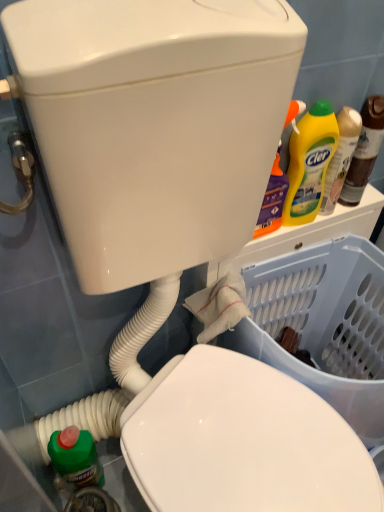
You are a GUI agent. You are given a task and a screenshot of the screen. Output one action in this format:
    pyautogui.click(x=<x>, y=<y>)
    Task: Click on the transparent plastic basket at lower right
    The height and width of the screenshot is (512, 384).
    Given the screenshot: What is the action you would take?
    pyautogui.click(x=323, y=325)

Image resolution: width=384 pixels, height=512 pixels. What are the coordinates of `cleaning product that appears on the left of transparent plastic basket at lower right` in the screenshot? It's located at (309, 163).

Based on the photo, could you tell me if yellow matte bottle at upper right is turned towards transparent plastic basket at lower right?

No, yellow matte bottle at upper right is not aimed at transparent plastic basket at lower right.

Looking at this image, can you see yellow matte bottle at upper right touching transparent plastic basket at lower right?

No.

Choose the correct answer: Is yellow matte bottle at upper right inside transparent plastic basket at lower right or outside it?

yellow matte bottle at upper right is not enclosed by transparent plastic basket at lower right.

Is yellow plastic bottle at upper right, the 1th bottle when ordered from left to right, looking in the opposite direction of transparent plastic basket at lower right?

No, yellow plastic bottle at upper right, the 1th bottle when ordered from left to right, is not facing the opposite direction of transparent plastic basket at lower right.

Considering the relative sizes of yellow plastic bottle at upper right, the 1th bottle when ordered from left to right, and transparent plastic basket at lower right in the image provided, is yellow plastic bottle at upper right, the 1th bottle when ordered from left to right, smaller than transparent plastic basket at lower right?

Yes.

What's the angular difference between yellow plastic bottle at upper right, the 1th bottle when ordered from left to right, and transparent plastic basket at lower right's facing directions?

The angular difference between yellow plastic bottle at upper right, the 1th bottle when ordered from left to right, and transparent plastic basket at lower right is 1.53 degrees.

Based on the photo, which object is closer to the camera taking this photo, yellow plastic bottle at upper right, the 2th bottle from the right, or transparent plastic basket at lower right?

transparent plastic basket at lower right is in front.

Can we say transparent plastic basket at lower right lies outside yellow plastic bottle at upper right, the 1th bottle when ordered from left to right?

Yes, transparent plastic basket at lower right is located beyond the bounds of yellow plastic bottle at upper right, the 1th bottle when ordered from left to right.

Is point (266, 293) more distant than point (353, 133)?

Yes.

Does transparent plastic basket at lower right touch yellow plastic bottle at upper right, the 1th bottle when ordered from left to right?

transparent plastic basket at lower right and yellow plastic bottle at upper right, the 1th bottle when ordered from left to right, are clearly separated.

Does transparent plastic basket at lower right lie in front of yellow matte bottle at upper right?

Result: Yes, the depth of transparent plastic basket at lower right is less than that of yellow matte bottle at upper right.

Which point is more distant from viewer, (282, 359) or (301, 190)?

The point (301, 190) is farther.

Which of these two, transparent plastic basket at lower right or yellow matte bottle at upper right, is bigger?

transparent plastic basket at lower right.

From a real-world perspective, between yellow liquid detergent at upper right, which is the second bottle from left to right, and yellow matte bottle at upper right, who is vertically lower?

In real-world perspective, yellow liquid detergent at upper right, which is the second bottle from left to right, is lower.

Does yellow liquid detergent at upper right, which is the 1th bottle from right to left, appear on the left side of yellow matte bottle at upper right?

Incorrect, yellow liquid detergent at upper right, which is the 1th bottle from right to left, is not on the left side of yellow matte bottle at upper right.

Is yellow liquid detergent at upper right, which is the second bottle from left to right, facing away from yellow matte bottle at upper right?

No.

Which of these two, yellow liquid detergent at upper right, which is the 1th bottle from right to left, or yellow matte bottle at upper right, stands shorter?

yellow liquid detergent at upper right, which is the 1th bottle from right to left.

From a real-world perspective, is yellow liquid detergent at upper right, which is the 1th bottle from right to left, above or below yellow plastic bottle at upper right, the 1th bottle when ordered from left to right?

From a real-world perspective, yellow liquid detergent at upper right, which is the 1th bottle from right to left, is physically above yellow plastic bottle at upper right, the 1th bottle when ordered from left to right.

Is yellow liquid detergent at upper right, which is the second bottle from left to right, facing towards yellow plastic bottle at upper right, the 2th bottle from the right?

No, yellow liquid detergent at upper right, which is the second bottle from left to right, is not oriented towards yellow plastic bottle at upper right, the 2th bottle from the right.

Is yellow liquid detergent at upper right, which is the second bottle from left to right, completely or partially outside of yellow plastic bottle at upper right, the 2th bottle from the right?

Yes, yellow liquid detergent at upper right, which is the second bottle from left to right, is outside of yellow plastic bottle at upper right, the 2th bottle from the right.

Visually, is transparent plastic basket at lower right positioned to the left or to the right of yellow liquid detergent at upper right, which is the 1th bottle from right to left?

transparent plastic basket at lower right is to the left of yellow liquid detergent at upper right, which is the 1th bottle from right to left.

Can you confirm if transparent plastic basket at lower right is wider than yellow liquid detergent at upper right, which is the 1th bottle from right to left?

Correct, the width of transparent plastic basket at lower right exceeds that of yellow liquid detergent at upper right, which is the 1th bottle from right to left.

Which object is more forward, transparent plastic basket at lower right or yellow liquid detergent at upper right, which is the second bottle from left to right?

transparent plastic basket at lower right.

Is transparent plastic basket at lower right turned away from yellow liquid detergent at upper right, which is the 1th bottle from right to left?

No, transparent plastic basket at lower right is not facing away from yellow liquid detergent at upper right, which is the 1th bottle from right to left.

Where is `cleaning product behind the transparent plastic basket at lower right`? cleaning product behind the transparent plastic basket at lower right is located at coordinates [309, 163].

Locate an element on the screen. basket container below the yellow plastic bottle at upper right, the 1th bottle when ordered from left to right (from the image's perspective) is located at coordinates (323, 325).

Which object lies further to the anchor point transparent plastic basket at lower right, yellow matte bottle at upper right or yellow plastic bottle at upper right, the 2th bottle from the right?

Based on the image, yellow plastic bottle at upper right, the 2th bottle from the right, appears to be further to transparent plastic basket at lower right.

Based on their spatial positions, is transparent plastic basket at lower right or yellow plastic bottle at upper right, the 1th bottle when ordered from left to right, further from yellow matte bottle at upper right?

The object further to yellow matte bottle at upper right is transparent plastic basket at lower right.

From the image, which object appears to be farther from transparent plastic basket at lower right, yellow matte bottle at upper right or yellow liquid detergent at upper right, which is the second bottle from left to right?

yellow liquid detergent at upper right, which is the second bottle from left to right, lies further to transparent plastic basket at lower right than the other object.

Looking at this image, when comparing their distances from yellow matte bottle at upper right, does yellow plastic bottle at upper right, the 2th bottle from the right, or transparent plastic basket at lower right seem closer?

yellow plastic bottle at upper right, the 2th bottle from the right.

Estimate the real-world distances between objects in this image. Which object is closer to transparent plastic basket at lower right, yellow plastic bottle at upper right, the 1th bottle when ordered from left to right, or yellow matte bottle at upper right?

yellow matte bottle at upper right lies closer to transparent plastic basket at lower right than the other object.

When comparing their distances from yellow plastic bottle at upper right, the 2th bottle from the right, does yellow matte bottle at upper right or transparent plastic basket at lower right seem further?

transparent plastic basket at lower right.

Estimate the real-world distances between objects in this image. Which object is further from yellow matte bottle at upper right, yellow liquid detergent at upper right, which is the second bottle from left to right, or yellow plastic bottle at upper right, the 1th bottle when ordered from left to right?

yellow liquid detergent at upper right, which is the second bottle from left to right, lies further to yellow matte bottle at upper right than the other object.

Considering their positions, is yellow plastic bottle at upper right, the 2th bottle from the right, positioned closer to yellow liquid detergent at upper right, which is the 1th bottle from right to left, than yellow matte bottle at upper right?

The object closer to yellow liquid detergent at upper right, which is the 1th bottle from right to left, is yellow plastic bottle at upper right, the 2th bottle from the right.

The image size is (384, 512). I want to click on cleaning product between yellow plastic bottle at upper right, the 1th bottle when ordered from left to right, and transparent plastic basket at lower right from top to bottom, so coord(309,163).

Locate an element on the screen. This screenshot has height=512, width=384. bottle located between yellow matte bottle at upper right and yellow liquid detergent at upper right, which is the 1th bottle from right to left, in the left-right direction is located at coordinates (341, 157).

Where is `bottle between yellow liquid detergent at upper right, which is the second bottle from left to right, and transparent plastic basket at lower right from top to bottom`? The height and width of the screenshot is (512, 384). bottle between yellow liquid detergent at upper right, which is the second bottle from left to right, and transparent plastic basket at lower right from top to bottom is located at coordinates (341, 157).

Where is `cleaning product between yellow liquid detergent at upper right, which is the 1th bottle from right to left, and transparent plastic basket at lower right vertically`? The image size is (384, 512). cleaning product between yellow liquid detergent at upper right, which is the 1th bottle from right to left, and transparent plastic basket at lower right vertically is located at coordinates (309, 163).